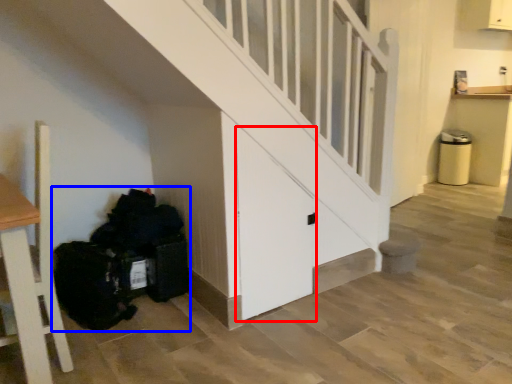
Question: Which object appears closest to the camera in this image, door (highlighted by a red box) or garbage (highlighted by a blue box)?

Choices:
 (A) door
 (B) garbage

Answer: (A)